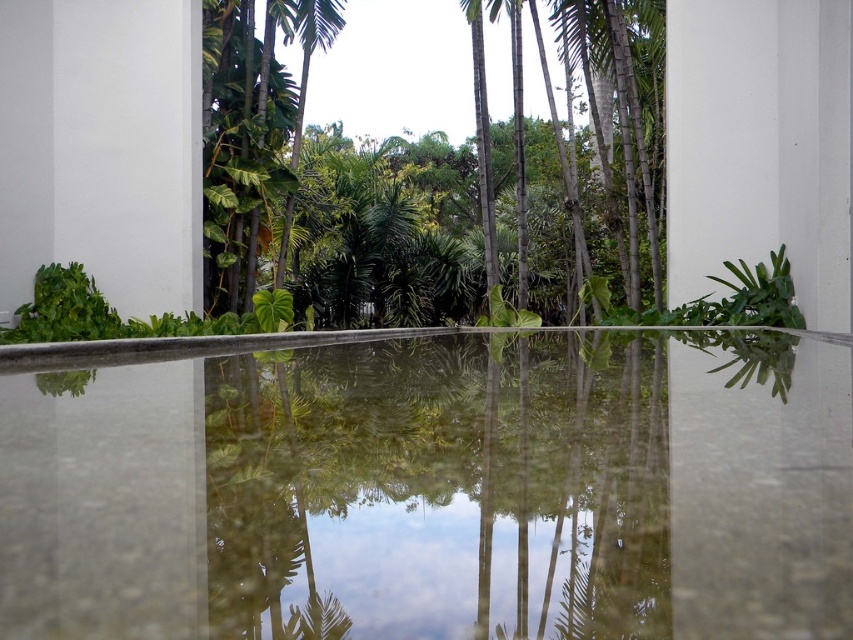
You are standing on the reflective surface in the scene. You want to look down and see the clear water at center and the green leafy tree at center. Which one is closer to you?

The clear water at center is closer to you since it is in front of the green leafy tree at center.

You are standing on the reflective surface and see the clear water at center and the green leafy tree at center. Which object is closer to the ground?

The clear water at center is closer to the ground than the green leafy tree at center because it is shorter.

You are standing on the reflective surface and see the clear water at center and the green leafy tree at center. Which object is positioned to the left of the other?

The clear water at center is to the left of the green leafy tree at center.